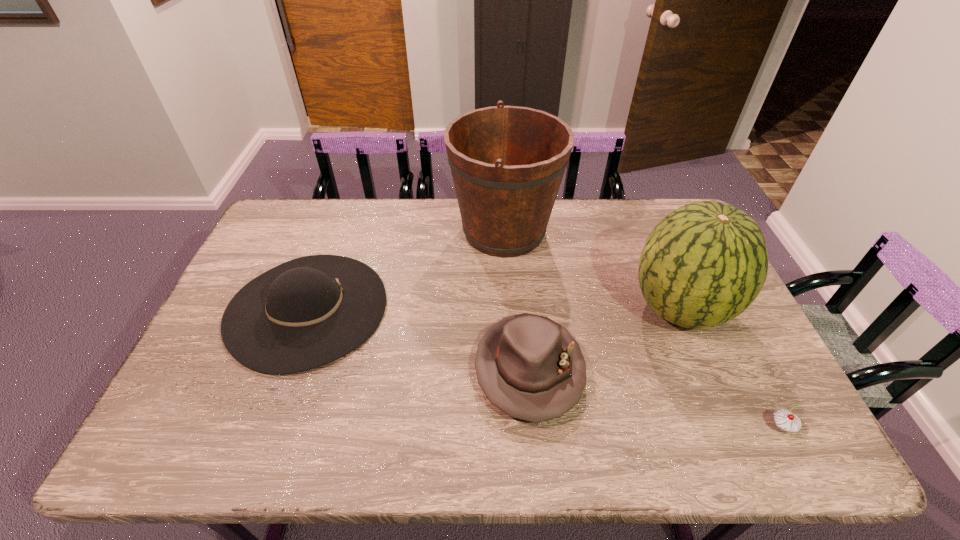
Select which object appears as the third closest to the hat. Please provide its 2D coordinates. Your answer should be formatted as a tuple, i.e. [(x, y)], where the tuple contains the x and y coordinates of a point satisfying the conditions above.

[(307, 312)]

Identify the location of free point that satisfies the following two spatial constraints: 1. on the front-facing side of the sombrero; 2. on the back side of the shortest object. This screenshot has width=960, height=540. (264, 427).

The image size is (960, 540). Find the location of `vacant space that satisfies the following two spatial constraints: 1. on the decorative side of the hat; 2. on the left side of the shortest object`. vacant space that satisfies the following two spatial constraints: 1. on the decorative side of the hat; 2. on the left side of the shortest object is located at coordinates (535, 427).

The height and width of the screenshot is (540, 960). Find the location of `vacant space that satisfies the following two spatial constraints: 1. on the front side of the watermelon; 2. on the left side of the cupcake`. vacant space that satisfies the following two spatial constraints: 1. on the front side of the watermelon; 2. on the left side of the cupcake is located at coordinates (730, 427).

The image size is (960, 540). I want to click on vacant region that satisfies the following two spatial constraints: 1. on the front side of the watermelon; 2. on the front-facing side of the sombrero, so click(680, 308).

This screenshot has height=540, width=960. What are the coordinates of `blank area in the image that satisfies the following two spatial constraints: 1. on the back side of the shortest object; 2. on the front-facing side of the leftmost object` in the screenshot? It's located at (721, 308).